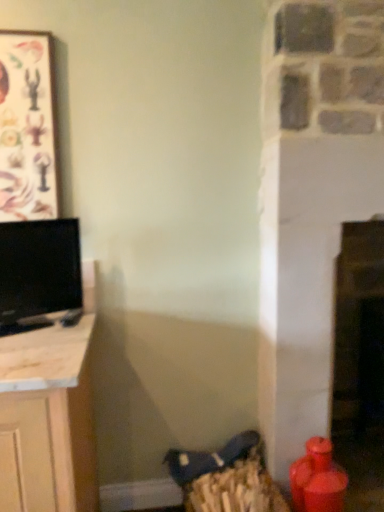
Question: From the image's perspective, is black glossy tv at left above or below wooden frame at upper left?

Choices:
 (A) above
 (B) below

Answer: (B)

Question: Visually, is black glossy tv at left positioned to the left or to the right of wooden frame at upper left?

Choices:
 (A) left
 (B) right

Answer: (B)

Question: Would you say black glossy tv at left is inside or outside wooden frame at upper left?

Choices:
 (A) outside
 (B) inside

Answer: (A)

Question: In terms of height, does wooden frame at upper left look taller or shorter compared to black glossy tv at left?

Choices:
 (A) short
 (B) tall

Answer: (B)

Question: From the image's perspective, is wooden frame at upper left above or below black glossy tv at left?

Choices:
 (A) above
 (B) below

Answer: (A)

Question: Is wooden frame at upper left spatially inside black glossy tv at left, or outside of it?

Choices:
 (A) outside
 (B) inside

Answer: (A)

Question: From a real-world perspective, relative to black glossy tv at left, is wooden frame at upper left vertically above or below?

Choices:
 (A) below
 (B) above

Answer: (B)